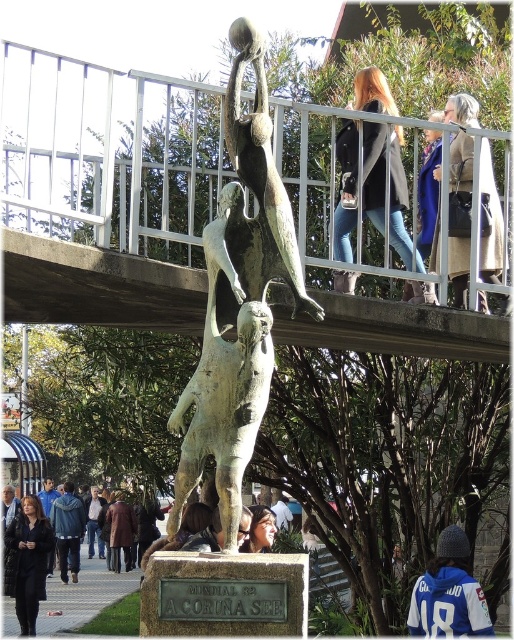
Consider the image. You are standing in front of the sculpture and want to take a photo that includes both the point at coordinates point (425, 288) and point (269, 534). Which point should you position closer to the camera to ensure both are in focus?

To ensure both points are in focus, position the camera closer to point (425, 288) since it is in front of point (269, 534), allowing the depth of field to cover both.

You are an artist preparing to photograph the dark brown leather jacket at lower left and the white cotton shirt at lower center. You need to ensure that both items fit within the frame of your camera. Since the jacket is wider than the shirt, which object should you adjust the camera angle to focus on first to capture the full width of both items?

The dark brown leather jacket at lower left has a larger width than the white cotton shirt at lower center. To capture both items fully, you should first focus on the dark brown leather jacket at lower left to ensure its full width fits in the frame, then adjust the angle to include the white cotton shirt at lower center.